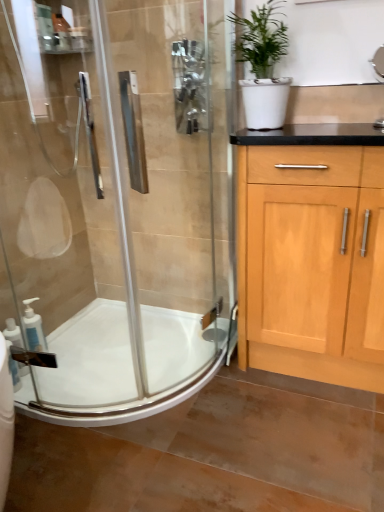
In order to click on vacant area that lies to the right of white matte soap dispenser at lower left, the 2th soap dispenser from the front in this screenshot , I will do `click(77, 358)`.